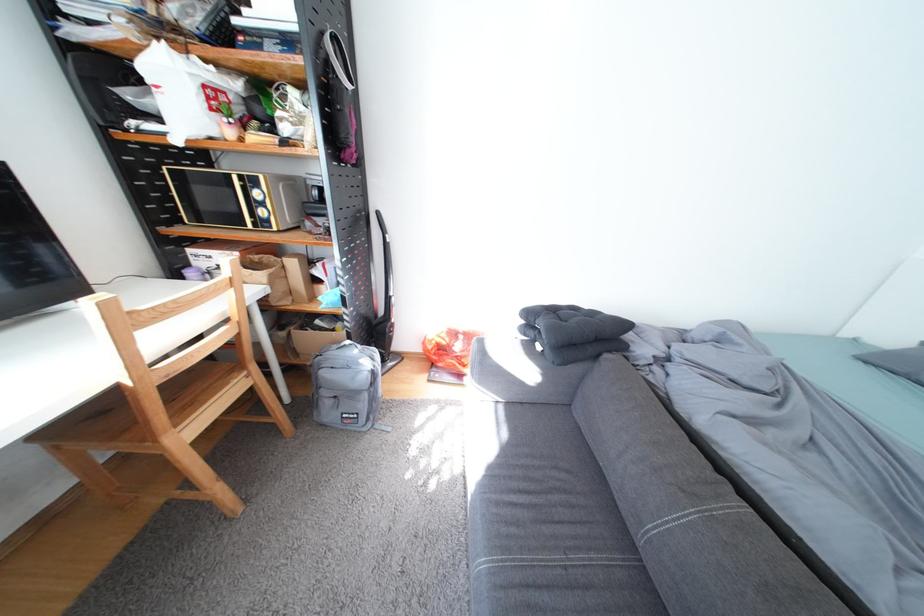
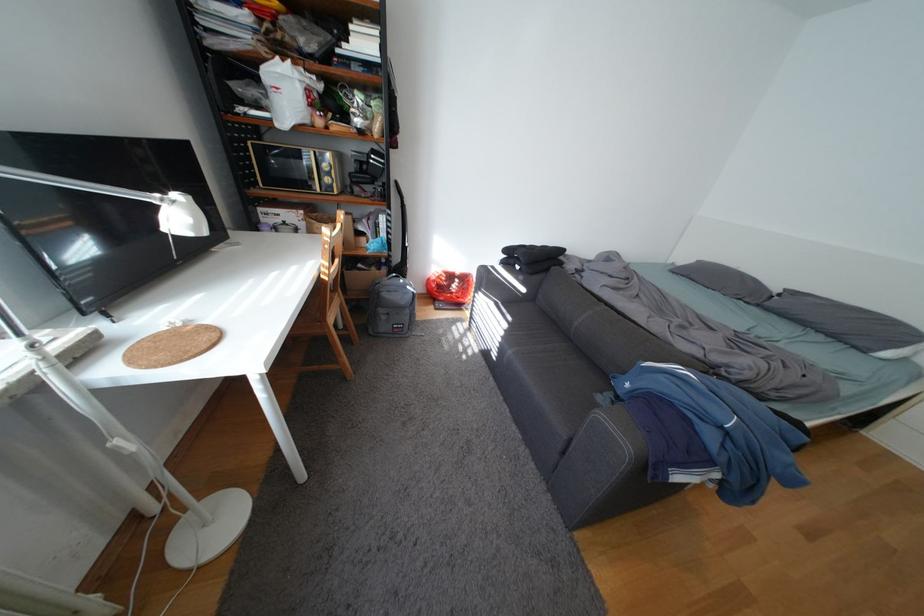
In a continuous first-person perspective shot, in which direction is the camera moving?

The cameraman walked toward left, backward.